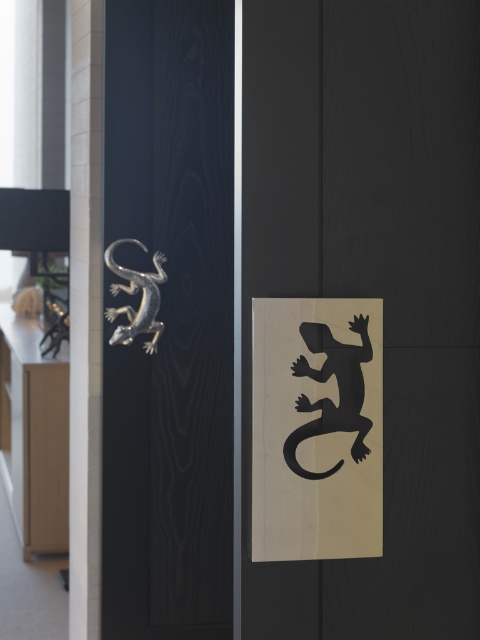
You are standing in front of a pair of doors with two lizard decorations. The metallic lizard at center is on the left door, and the black matte lizard at center is on the right door. If you want to touch both decorations, which one will you reach first as you approach the doors?

The metallic lizard at center will be reached first because it is positioned in front of the black matte lizard at center, meaning it is closer to you as you approach the doors.

You are designing a display for these two lizards and need to ensure they are spaced appropriately. Since the black matte lizard at center is smaller than the polished silver lizard at upper left, what should you consider when placing them to maintain visual balance?

To maintain visual balance between the black matte lizard at center and the polished silver lizard at upper left, you should position the smaller black matte lizard at center farther from the larger polished silver lizard at upper left, as smaller objects can be placed farther apart to balance the visual weight with larger ones.

You are standing in front of two doors with decorations. You need to place a new sticker between the black matte lizard at center and the polished silver lizard at upper left. Where should you place it?

The black matte lizard at center is to the right of the polished silver lizard at upper left, so you should place the sticker between them to the right of the polished silver lizard at upper left and to the left of the black matte lizard at center.